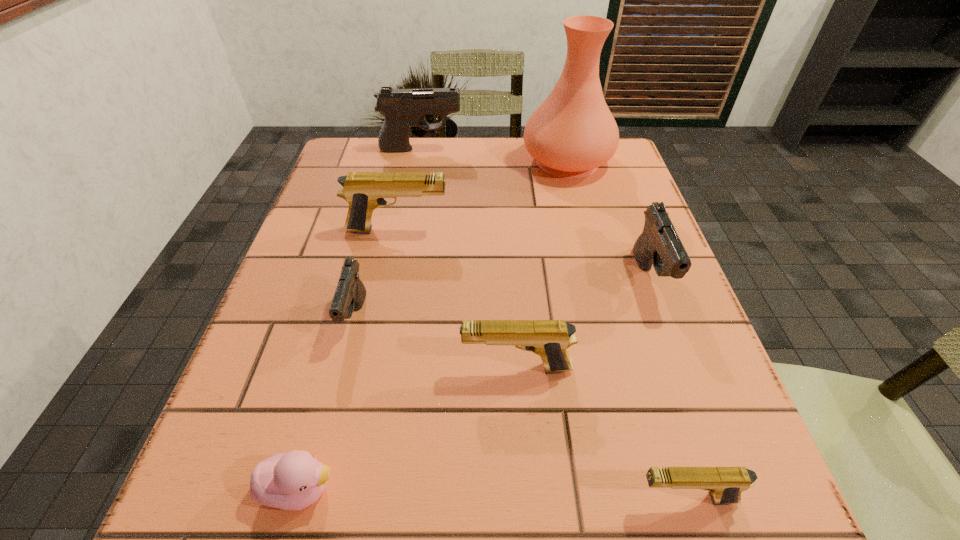
Where is `free space that is in between the second smallest black pistol and the farthest black pistol`? free space that is in between the second smallest black pistol and the farthest black pistol is located at coordinates (536, 213).

Image resolution: width=960 pixels, height=540 pixels. I want to click on blank region between the second biggest black pistol and the shortest pistol, so click(667, 388).

The height and width of the screenshot is (540, 960). What are the coordinates of `empty location between the rightmost black pistol and the fourth pistol from left to right` in the screenshot? It's located at (584, 323).

Locate an element on the screen. empty space between the vase and the smallest black pistol is located at coordinates (461, 239).

This screenshot has height=540, width=960. Find the location of `unoccupied area between the fifth farthest pistol and the second tallest object`. unoccupied area between the fifth farthest pistol and the second tallest object is located at coordinates (468, 259).

Locate an element on the screen. This screenshot has width=960, height=540. free spot between the second smallest black pistol and the duckling is located at coordinates (476, 383).

Where is `vacant area that lies between the smallest black pistol and the tallest object`? vacant area that lies between the smallest black pistol and the tallest object is located at coordinates (461, 239).

The width and height of the screenshot is (960, 540). What are the coordinates of `vacant region between the smallest black pistol and the tallest pistol` in the screenshot? It's located at (388, 233).

Identify the location of free point between the duckling and the smallest black pistol. (328, 403).

In order to click on object that is the sixth closest to the second biggest black pistol in this screenshot , I will do `click(350, 294)`.